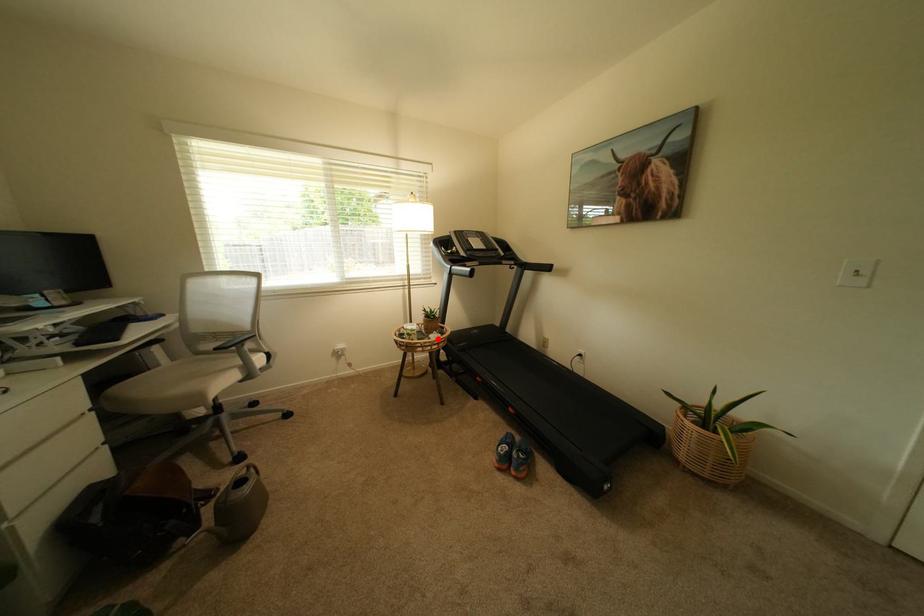
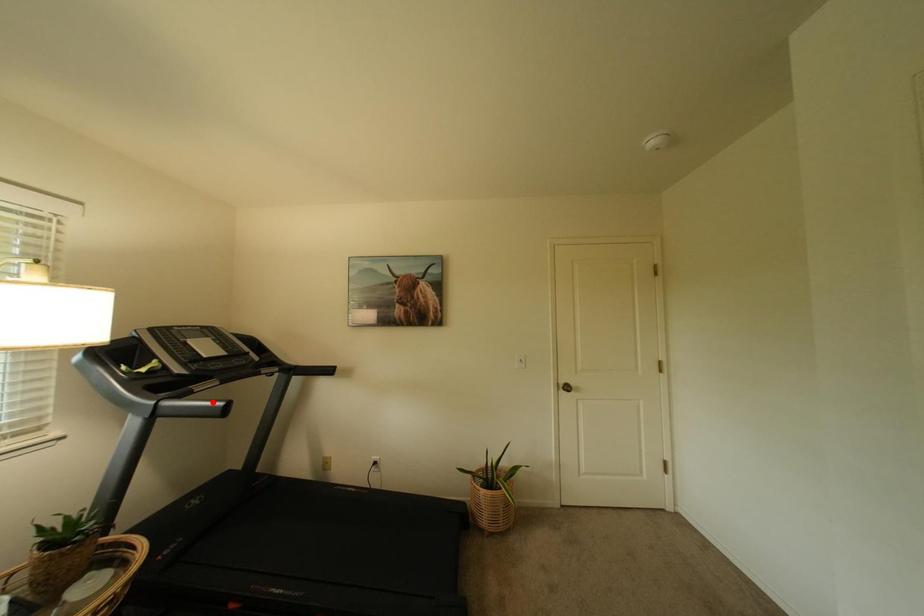
I am providing you with two images of the same scene from different viewpoints. A red point is marked on the first image and another point is marked on the second image. Is the marked point in image1 the same physical position as the marked point in image2?

No